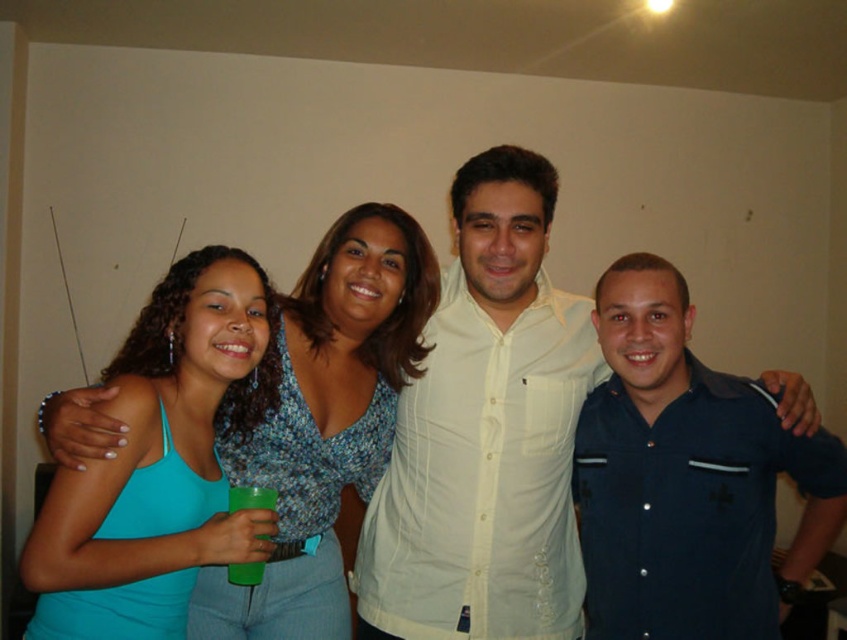
Can you confirm if dark blue shirt at center is wider than green plastic cup at center?

Indeed, dark blue shirt at center has a greater width compared to green plastic cup at center.

Which is below, dark blue shirt at center or green plastic cup at center?

Positioned lower is green plastic cup at center.

Locate an element on the screen. dark blue shirt at center is located at coordinates (687, 477).

Which is more to the left, white button-up shirt at center or teal fabric tank top at left?

teal fabric tank top at left

Is white button-up shirt at center smaller than teal fabric tank top at left?

No.

Find the location of a particular element. This screenshot has height=640, width=847. white button-up shirt at center is located at coordinates (486, 433).

Locate an element on the screen. The width and height of the screenshot is (847, 640). white button-up shirt at center is located at coordinates [x=486, y=433].

Is teal fabric tank top at left smaller than green plastic cup at center?

Incorrect, teal fabric tank top at left is not smaller in size than green plastic cup at center.

Is teal fabric tank top at left to the right of green plastic cup at center from the viewer's perspective?

Indeed, teal fabric tank top at left is positioned on the right side of green plastic cup at center.

Is point (368, 371) closer to viewer compared to point (257, 577)?

No, it is not.

Locate an element on the screen. teal fabric tank top at left is located at coordinates pyautogui.click(x=325, y=420).